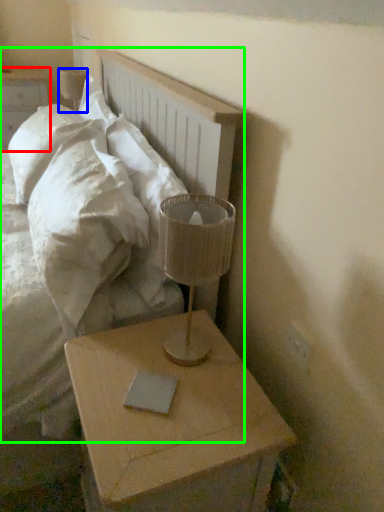
Question: Which object is positioned closest to nightstand (highlighted by a red box)? Select from table lamp (highlighted by a blue box) and bed (highlighted by a green box).

Choices:
 (A) table lamp
 (B) bed

Answer: (A)